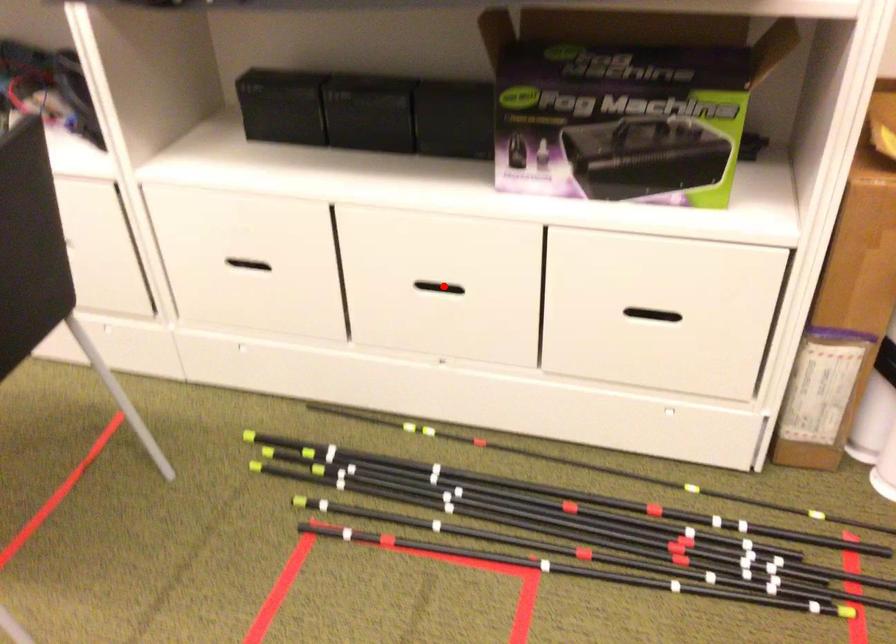
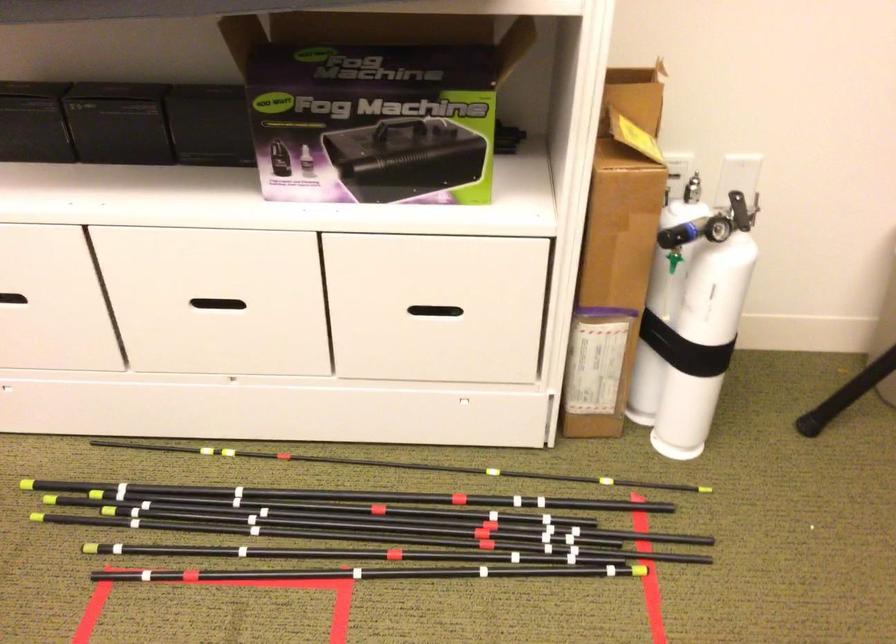
The point at the highlighted location is marked in the first image. Where is the corresponding point in the second image?

(225, 299)